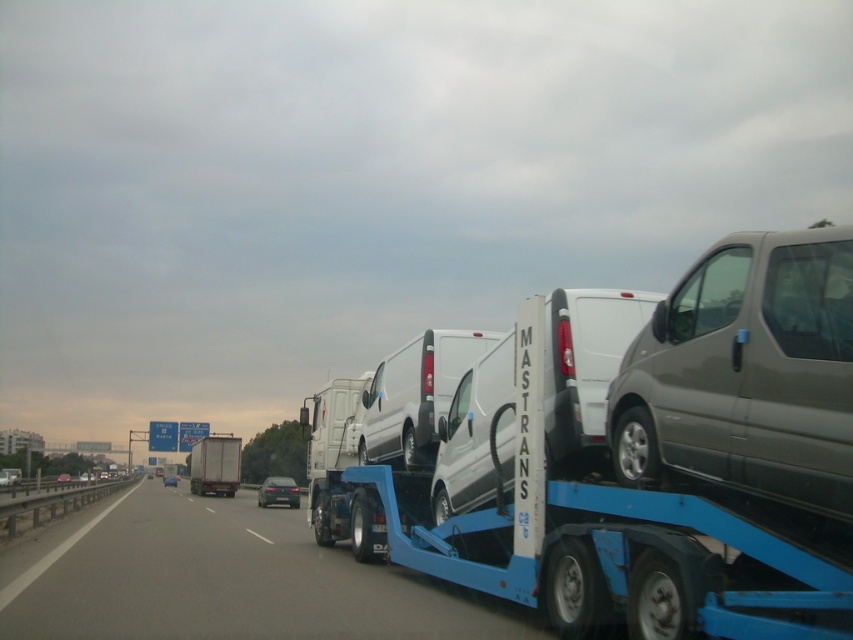
Can you confirm if blue metallic truck at center is shorter than white matte van at center?

No.

Is blue metallic truck at center further to camera compared to white matte van at center?

No.

Does point (392, 618) come in front of point (428, 372)?

Yes, point (392, 618) is closer to viewer.

At what (x,y) coordinates should I click in order to perform the action: click on blue metallic truck at center. Please return your answer as a coordinate pair (x, y). The height and width of the screenshot is (640, 853). Looking at the image, I should click on (222, 579).

The image size is (853, 640). What do you see at coordinates (746, 372) in the screenshot?
I see `matte gray van at right` at bounding box center [746, 372].

Which is in front, point (746, 284) or point (468, 330)?

Positioned in front is point (746, 284).

Is point (787, 240) in front of point (445, 413)?

Yes, point (787, 240) is in front of point (445, 413).

Locate an element on the screen. The width and height of the screenshot is (853, 640). matte gray van at right is located at coordinates pyautogui.click(x=746, y=372).

Who is taller, matte gray van at right or matte silver truck at center?

matte silver truck at center is taller.

Is matte gray van at right in front of matte silver truck at center?

Yes.

Between point (621, 432) and point (218, 477), which one is positioned behind?

The point (218, 477) is behind.

Locate an element on the screen. matte gray van at right is located at coordinates (746, 372).